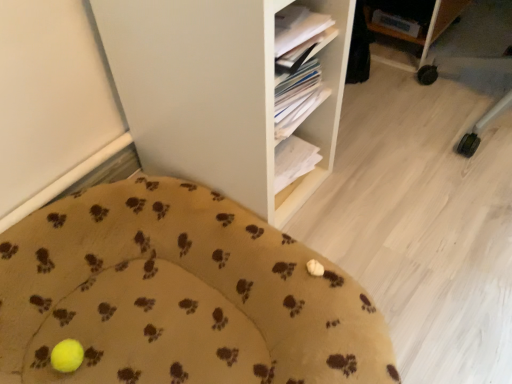
Question: Is white matte shelf at center to the right of yellow fabric cushion at lower left from the viewer's perspective?

Choices:
 (A) no
 (B) yes

Answer: (B)

Question: Can you confirm if white matte shelf at center is smaller than yellow fabric cushion at lower left?

Choices:
 (A) yes
 (B) no

Answer: (B)

Question: Does white matte shelf at center lie in front of yellow fabric cushion at lower left?

Choices:
 (A) yes
 (B) no

Answer: (B)

Question: Is white matte shelf at center wider than yellow fabric cushion at lower left?

Choices:
 (A) yes
 (B) no

Answer: (B)

Question: Is white matte shelf at center further to camera compared to yellow fabric cushion at lower left?

Choices:
 (A) no
 (B) yes

Answer: (B)

Question: Is white matte shelf at center positioned beyond the bounds of yellow fabric cushion at lower left?

Choices:
 (A) yes
 (B) no

Answer: (A)

Question: Is yellow fabric cushion at lower left behind white matte shelf at center?

Choices:
 (A) no
 (B) yes

Answer: (A)

Question: Can you confirm if yellow fabric cushion at lower left is thinner than white matte shelf at center?

Choices:
 (A) yes
 (B) no

Answer: (B)

Question: From the image's perspective, does yellow fabric cushion at lower left appear higher than white matte shelf at center?

Choices:
 (A) no
 (B) yes

Answer: (A)

Question: Is the position of yellow fabric cushion at lower left less distant than that of white matte shelf at center?

Choices:
 (A) yes
 (B) no

Answer: (A)

Question: Does yellow fabric cushion at lower left have a lesser height compared to white matte shelf at center?

Choices:
 (A) no
 (B) yes

Answer: (B)

Question: Is yellow fabric cushion at lower left bigger than white matte shelf at center?

Choices:
 (A) yes
 (B) no

Answer: (B)

Question: Does point (121, 266) appear closer or farther from the camera than point (176, 102)?

Choices:
 (A) closer
 (B) farther

Answer: (B)